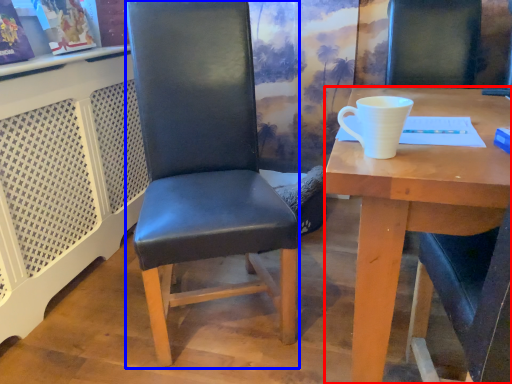
Question: Which object is further to the camera taking this photo, desk (highlighted by a red box) or chair (highlighted by a blue box)?

Choices:
 (A) desk
 (B) chair

Answer: (B)